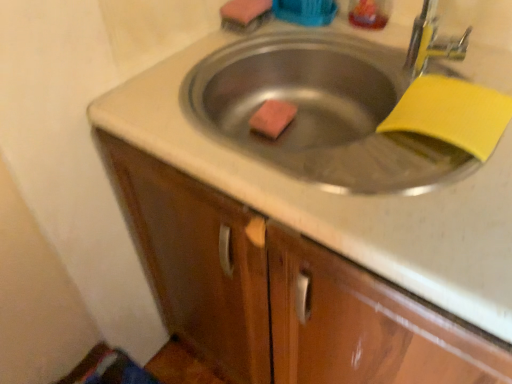
What are the coordinates of `free space on the front side of pink sponge at upper center, which appears as the first soap when viewed from the top` in the screenshot? It's located at coord(225,51).